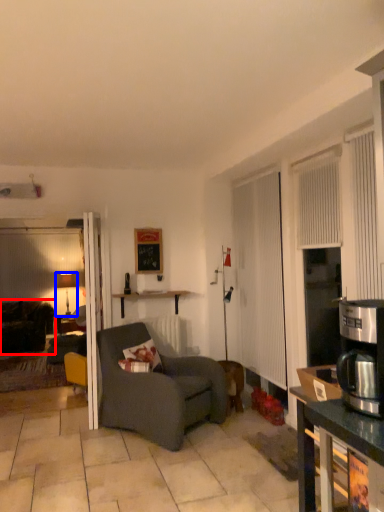
Question: Among these objects, which one is farthest to the camera, studio couch (highlighted by a red box) or lamp (highlighted by a blue box)?

Choices:
 (A) studio couch
 (B) lamp

Answer: (B)